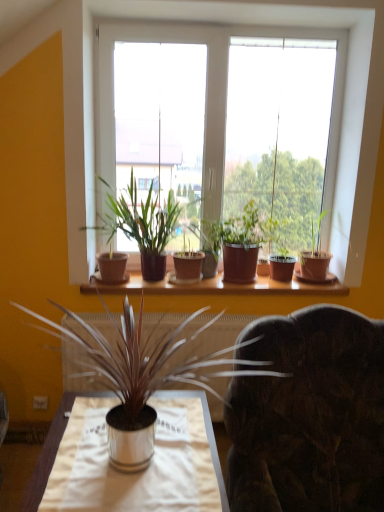
The height and width of the screenshot is (512, 384). What are the coordinates of `vacant space situated above metallic silver table at lower center (from a real-world perspective)` in the screenshot? It's located at (119, 444).